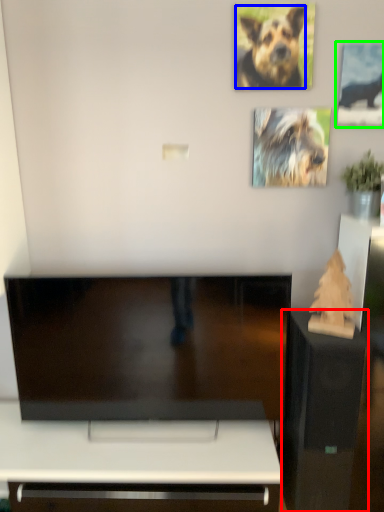
Question: Estimate the real-world distances between objects in this image. Which object is closer to furniture (highlighted by a red box), dog (highlighted by a blue box) or picture frame (highlighted by a green box)?

Choices:
 (A) dog
 (B) picture frame

Answer: (B)